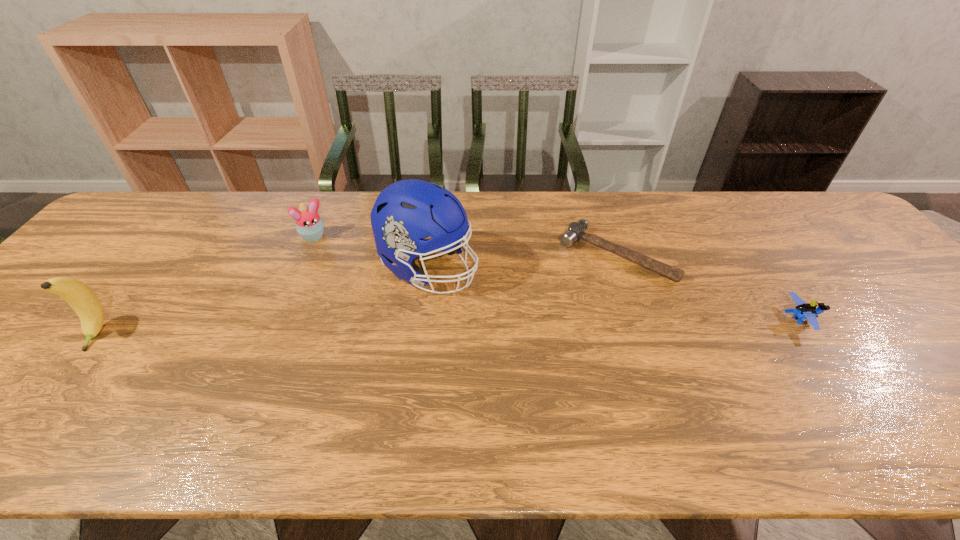
The height and width of the screenshot is (540, 960). In order to click on banana in this screenshot , I will do `click(79, 296)`.

Identify the location of the leftmost object. The image size is (960, 540). (79, 296).

Locate an element on the screen. The width and height of the screenshot is (960, 540). the second shortest object is located at coordinates (804, 311).

This screenshot has height=540, width=960. I want to click on Lego, so click(x=804, y=311).

Locate an element on the screen. Image resolution: width=960 pixels, height=540 pixels. the third object from left to right is located at coordinates (406, 212).

Locate an element on the screen. Image resolution: width=960 pixels, height=540 pixels. the tallest object is located at coordinates (406, 212).

Identify the location of hammer. (576, 231).

The image size is (960, 540). In order to click on the fourth object from left to right in this screenshot , I will do `click(576, 231)`.

I want to click on the third tallest object, so click(x=309, y=225).

You are a GUI agent. You are given a task and a screenshot of the screen. Output one action in this format:
    pyautogui.click(x=<x>, y=<y>)
    Task: Click on the cupcake
    The image size is (960, 540).
    Given the screenshot: What is the action you would take?
    pyautogui.click(x=309, y=225)